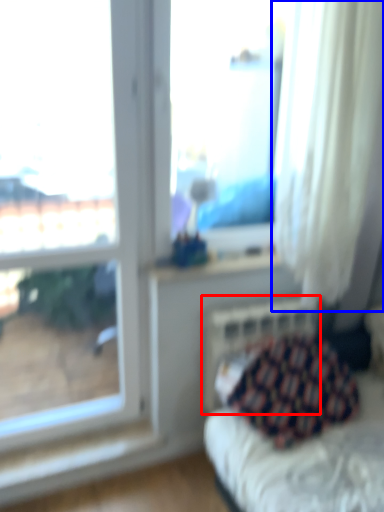
Question: Which point is further to the camera, radiator (highlighted by a red box) or curtain (highlighted by a blue box)?

Choices:
 (A) radiator
 (B) curtain

Answer: (A)